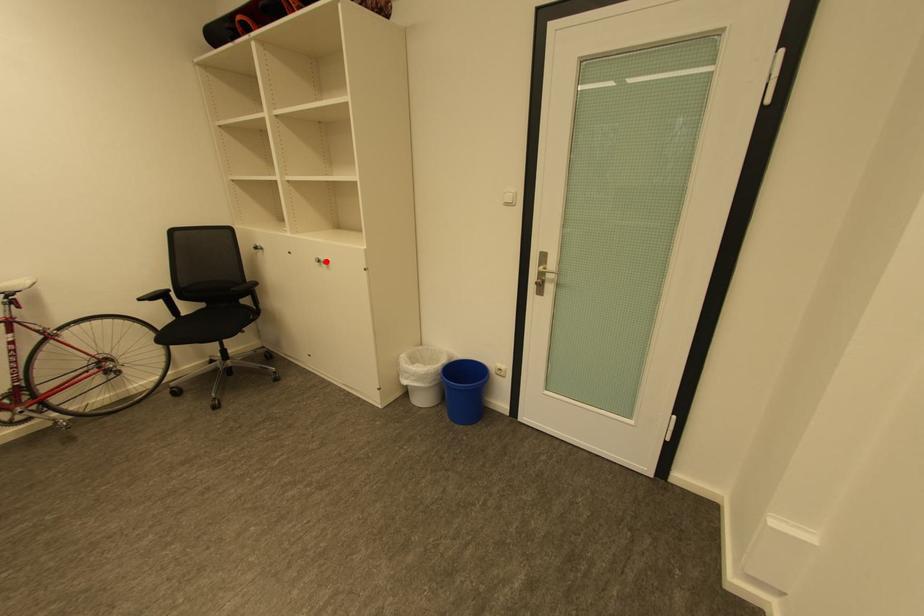
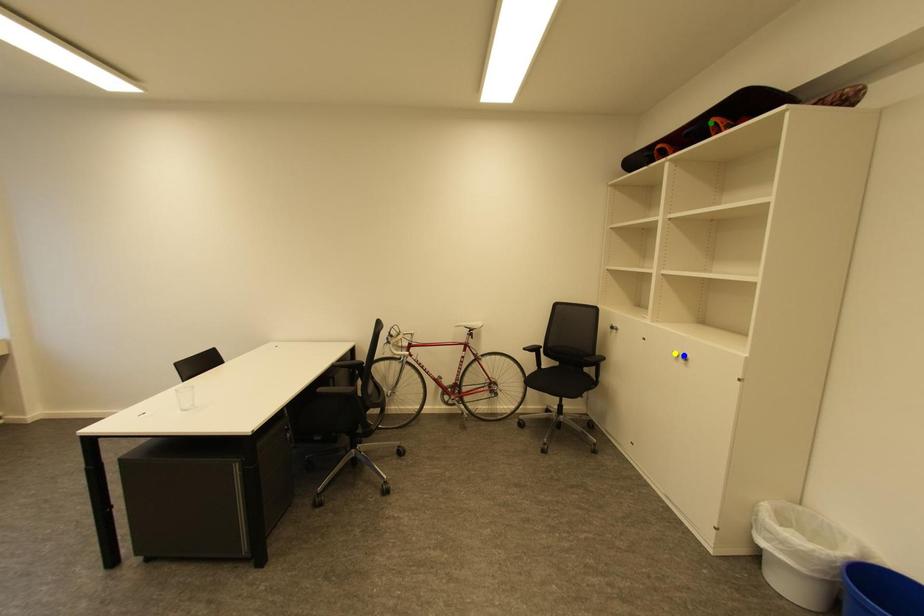
Question: I am providing you with two images of the same scene from different viewpoints. A red point is marked on the first image. You are given multiple points on the second image. Which point in image 2 represents the same 3d spot as the red point in image 1?

Choices:
 (A) green point
 (B) blue point
 (C) yellow point

Answer: (B)